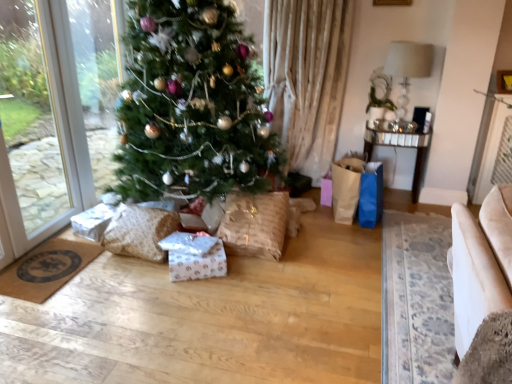
Question: Does burlap wrapped gift at center, the 1th pillow viewed from the right, contain textured beige pillow at lower left, the second pillow from the right?

Choices:
 (A) yes
 (B) no

Answer: (B)

Question: Does burlap wrapped gift at center, the 2th pillow when ordered from left to right, have a greater height compared to textured beige pillow at lower left, the 1th pillow when ordered from left to right?

Choices:
 (A) no
 (B) yes

Answer: (B)

Question: Is the position of burlap wrapped gift at center, the 1th pillow viewed from the right, less distant than that of textured beige pillow at lower left, the second pillow from the right?

Choices:
 (A) yes
 (B) no

Answer: (B)

Question: From the image's perspective, is burlap wrapped gift at center, the 2th pillow when ordered from left to right, under textured beige pillow at lower left, the 1th pillow when ordered from left to right?

Choices:
 (A) yes
 (B) no

Answer: (B)

Question: Is burlap wrapped gift at center, the 1th pillow viewed from the right, not inside textured beige pillow at lower left, the 1th pillow when ordered from left to right?

Choices:
 (A) yes
 (B) no

Answer: (A)

Question: From a real-world perspective, relative to mirrored glass table at right, is burlap wrapped gift at center, the 1th pillow viewed from the right, vertically above or below?

Choices:
 (A) above
 (B) below

Answer: (B)

Question: In terms of size, does burlap wrapped gift at center, the 1th pillow viewed from the right, appear bigger or smaller than mirrored glass table at right?

Choices:
 (A) big
 (B) small

Answer: (A)

Question: Considering the relative positions of burlap wrapped gift at center, the 1th pillow viewed from the right, and mirrored glass table at right in the image provided, is burlap wrapped gift at center, the 1th pillow viewed from the right, to the left or to the right of mirrored glass table at right?

Choices:
 (A) left
 (B) right

Answer: (A)

Question: Relative to mirrored glass table at right, is burlap wrapped gift at center, the 1th pillow viewed from the right, in front or behind?

Choices:
 (A) front
 (B) behind

Answer: (A)

Question: Choose the correct answer: Is beige fabric armchair at lower right inside textured beige pillow at lower left, the 1th pillow when ordered from left to right, or outside it?

Choices:
 (A) outside
 (B) inside

Answer: (A)

Question: From a real-world perspective, is beige fabric armchair at lower right physically located above or below textured beige pillow at lower left, the 1th pillow when ordered from left to right?

Choices:
 (A) above
 (B) below

Answer: (B)

Question: In terms of size, does beige fabric armchair at lower right appear bigger or smaller than textured beige pillow at lower left, the 1th pillow when ordered from left to right?

Choices:
 (A) big
 (B) small

Answer: (A)

Question: Is beige fabric armchair at lower right in front of or behind textured beige pillow at lower left, the second pillow from the right, in the image?

Choices:
 (A) front
 (B) behind

Answer: (A)

Question: Considering the positions of beige fabric armchair at lower right and burlap wrapped gift at center, the 1th pillow viewed from the right, in the image, is beige fabric armchair at lower right bigger or smaller than burlap wrapped gift at center, the 1th pillow viewed from the right,?

Choices:
 (A) small
 (B) big

Answer: (A)

Question: Is beige fabric armchair at lower right spatially inside burlap wrapped gift at center, the 2th pillow when ordered from left to right, or outside of it?

Choices:
 (A) inside
 (B) outside

Answer: (B)